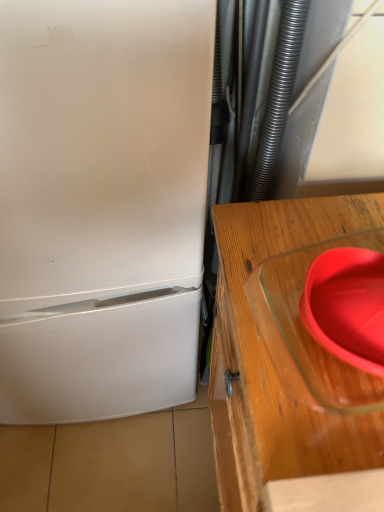
The height and width of the screenshot is (512, 384). Find the location of `vacant space that is to the left of matte glass bowl at right`. vacant space that is to the left of matte glass bowl at right is located at coordinates (261, 331).